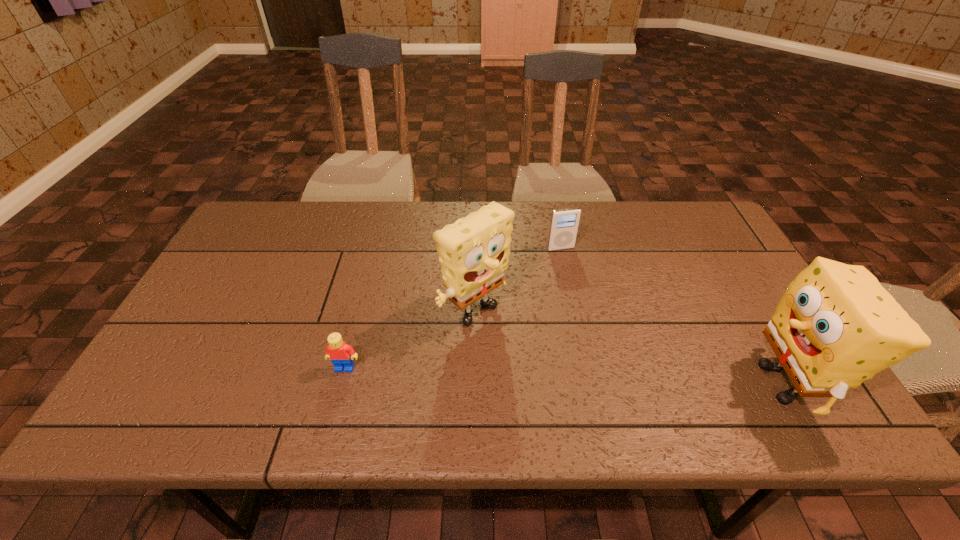
You are a GUI agent. You are given a task and a screenshot of the screen. Output one action in this format:
    pyautogui.click(x=<x>, y=<y>)
    Task: Click on the vacant area that lies between the third object from right to left and the rightmost object
    
    Given the screenshot: What is the action you would take?
    pyautogui.click(x=630, y=350)

Locate an element on the screen. Image resolution: width=960 pixels, height=540 pixels. free space between the second object from left to right and the second shortest object is located at coordinates (518, 282).

You are a GUI agent. You are given a task and a screenshot of the screen. Output one action in this format:
    pyautogui.click(x=<x>, y=<y>)
    Task: Click on the empty location between the shortest object and the rightmost object
    
    Given the screenshot: What is the action you would take?
    pyautogui.click(x=564, y=375)

This screenshot has height=540, width=960. Find the location of `free space between the third tallest object and the left sponge`. free space between the third tallest object and the left sponge is located at coordinates (518, 282).

Find the location of a particular element. Image resolution: width=960 pixels, height=540 pixels. free space that is in between the second object from right to left and the rightmost object is located at coordinates (672, 315).

The width and height of the screenshot is (960, 540). Find the location of `free spot between the Lego and the third tallest object`. free spot between the Lego and the third tallest object is located at coordinates (453, 308).

Locate an element on the screen. The width and height of the screenshot is (960, 540). object that is the third closest one to the Lego is located at coordinates (836, 326).

Point out which object is positioned as the nearest to the rightmost object. Please provide its 2D coordinates. Your answer should be formatted as a tuple, i.e. [(x, y)], where the tuple contains the x and y coordinates of a point satisfying the conditions above.

[(564, 223)]

Locate an element on the screen. The height and width of the screenshot is (540, 960). free space that satisfies the following two spatial constraints: 1. on the face of the Lego; 2. on the face of the rightmost object is located at coordinates (341, 383).

Locate an element on the screen. free space that satisfies the following two spatial constraints: 1. on the face of the right sponge; 2. on the face of the shortest object is located at coordinates (341, 383).